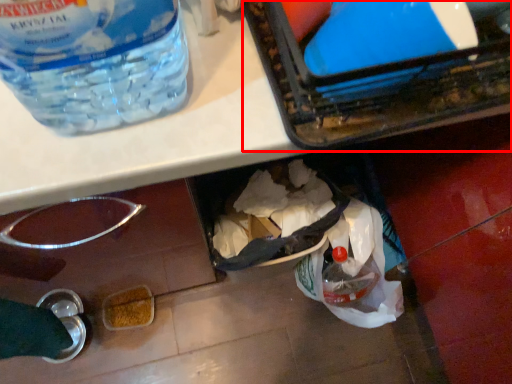
Question: Considering the relative positions of box (annotated by the red box) and bottle in the image provided, where is box (annotated by the red box) located with respect to the staircase?

Choices:
 (A) left
 (B) right

Answer: (B)